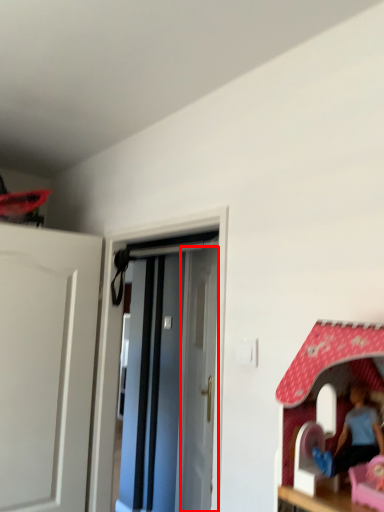
Question: From the image's perspective, where is door (annotated by the red box) located in relation to door in the image?

Choices:
 (A) below
 (B) above

Answer: (A)